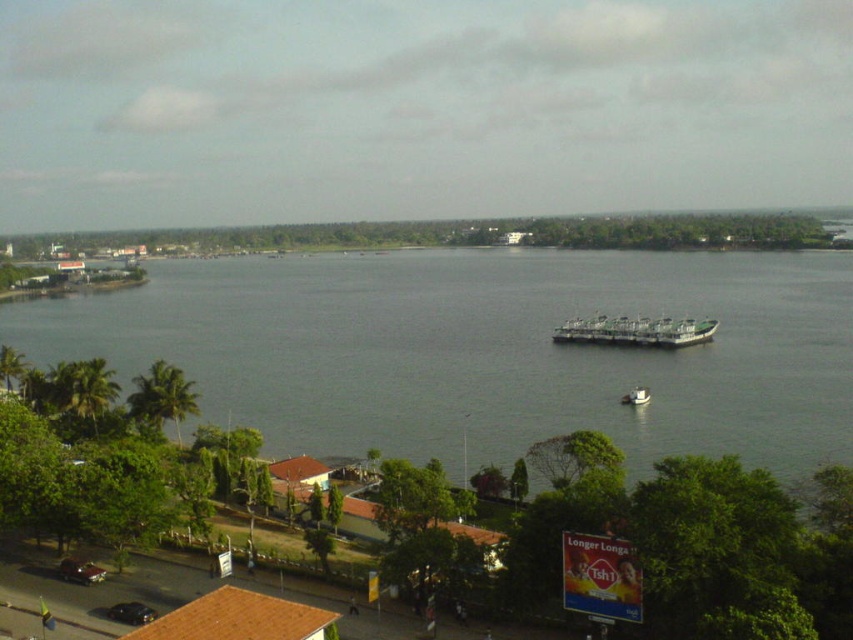
Question: Which object is closer to the camera taking this photo?

Choices:
 (A) gray water at center
 (B) white matte boat at center

Answer: (A)

Question: Which is nearer to the gray water at center?

Choices:
 (A) white matte boat at center
 (B) green matte barge at center

Answer: (B)

Question: Where is gray water at center located in relation to green matte barge at center in the image?

Choices:
 (A) below
 (B) above

Answer: (B)

Question: Considering the relative positions of green matte barge at center and white matte boat at center in the image provided, where is green matte barge at center located with respect to white matte boat at center?

Choices:
 (A) right
 (B) left

Answer: (A)

Question: Which point is closer to the camera?

Choices:
 (A) gray water at center
 (B) white matte boat at center

Answer: (A)

Question: Is gray water at center closer to the viewer compared to green matte barge at center?

Choices:
 (A) no
 (B) yes

Answer: (B)